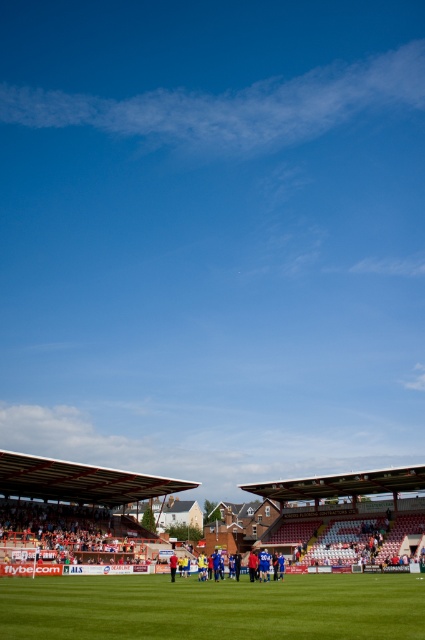
This screenshot has height=640, width=425. Describe the element at coordinates (212, 608) in the screenshot. I see `green grass football field at center` at that location.

The height and width of the screenshot is (640, 425). I want to click on green grass football field at center, so point(212,608).